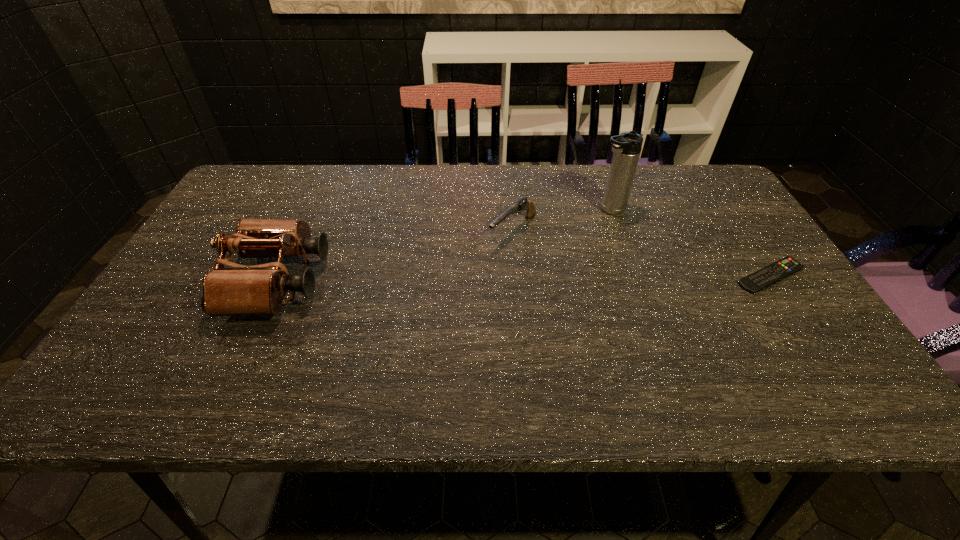
You are a GUI agent. You are given a task and a screenshot of the screen. Output one action in this format:
    pyautogui.click(x=<x>, y=<y>)
    Task: Click on the unoccupied position between the binoculars and the second shortest object
    This screenshot has height=540, width=960.
    Given the screenshot: What is the action you would take?
    pyautogui.click(x=396, y=256)

This screenshot has width=960, height=540. Identify the location of vacant region between the shortest object and the second tallest object. (524, 279).

The height and width of the screenshot is (540, 960). What are the coordinates of `empty location between the shortest object and the third tallest object` in the screenshot? It's located at (641, 254).

The width and height of the screenshot is (960, 540). What are the coordinates of `blank region between the second tallest object and the second shortest object` in the screenshot? It's located at (396, 256).

In order to click on vacant area that lies between the shortest object and the third tallest object in this screenshot , I will do `click(641, 254)`.

Locate an element on the screen. This screenshot has height=540, width=960. object that is the third closest to the thermos bottle is located at coordinates 257,290.

In order to click on the third closest object to the second object from left to right in this screenshot , I will do `click(779, 270)`.

The height and width of the screenshot is (540, 960). In order to click on free space that satisfies the following two spatial constraints: 1. on the front side of the third object from right to left; 2. on the right side of the remote control in this screenshot , I will do `click(516, 276)`.